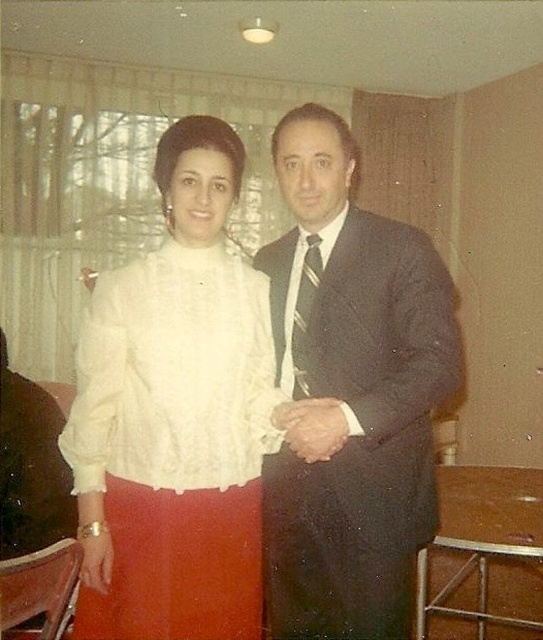
Question: Which of these objects is positioned closest to the striped silk tie at center?

Choices:
 (A) dark gray suit at center
 (B) white lace blouse at center

Answer: (A)

Question: Is white lace blouse at center to the right of dark gray suit at center from the viewer's perspective?

Choices:
 (A) no
 (B) yes

Answer: (A)

Question: Which of the following is the closest to the observer?

Choices:
 (A) (298, 387)
 (B) (142, 310)

Answer: (B)

Question: Is white lace blouse at center above dark gray suit at center?

Choices:
 (A) yes
 (B) no

Answer: (A)

Question: Which object is farther from the camera taking this photo?

Choices:
 (A) dark gray suit at center
 (B) white lace blouse at center

Answer: (A)

Question: Does dark gray suit at center have a smaller size compared to striped silk tie at center?

Choices:
 (A) yes
 (B) no

Answer: (B)